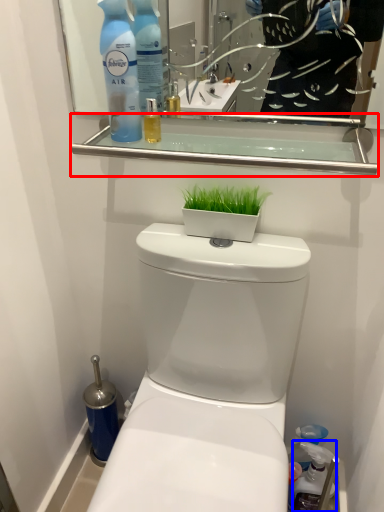
Question: Among these objects, which one is nearest to the camera, balustrade (highlighted by a red box) or cleaning product (highlighted by a blue box)?

Choices:
 (A) balustrade
 (B) cleaning product

Answer: (A)